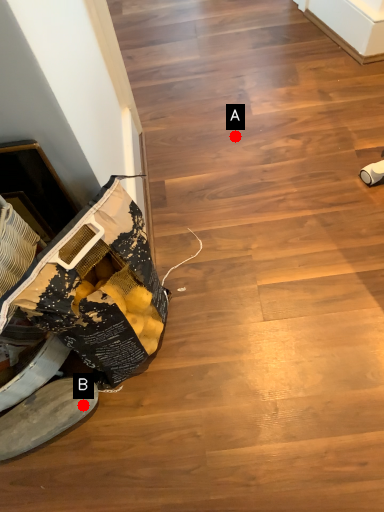
Question: Two points are circled on the image, labeled by A and B beside each circle. Which point is closer to the camera?

Choices:
 (A) A is closer
 (B) B is closer

Answer: (B)